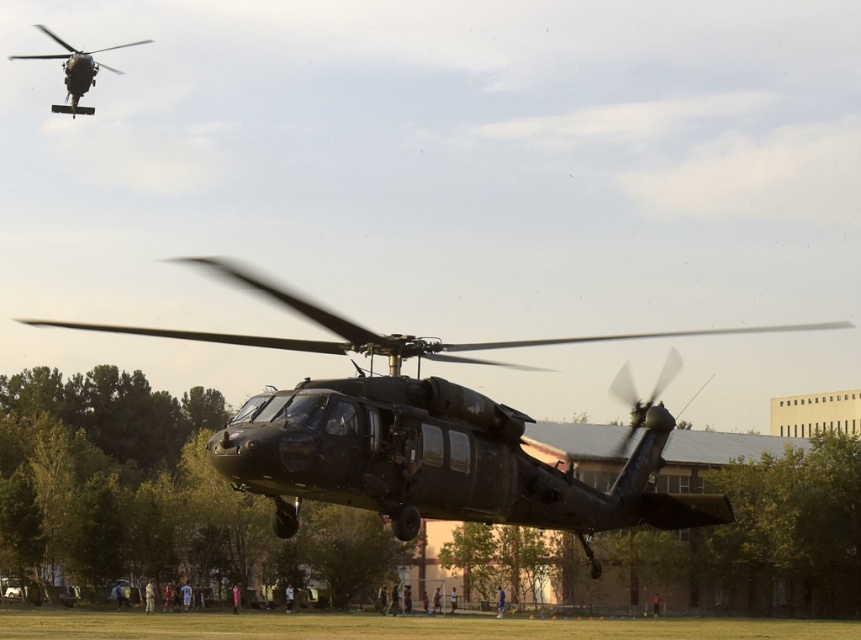
From the picture: Is matte black helicopter at center to the right of matte black helicopter at upper left from the viewer's perspective?

Yes, matte black helicopter at center is to the right of matte black helicopter at upper left.

Is point (492, 493) farther from viewer compared to point (65, 108)?

No, it is not.

Identify the location of matte black helicopter at center. (431, 436).